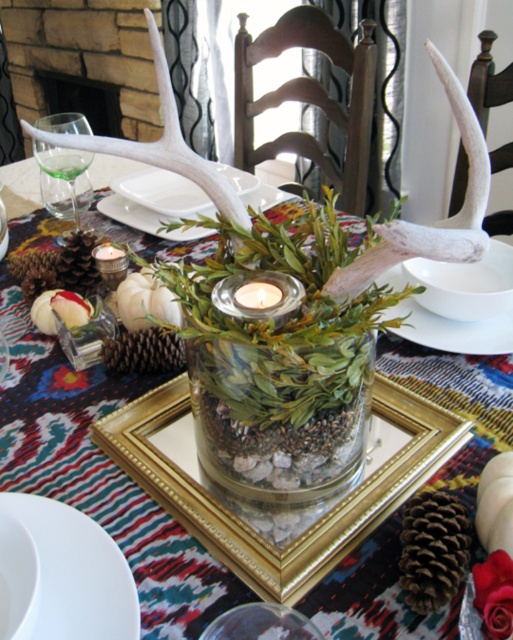
Does white porcelain plate at center appear over translucent glass platter at center?

Yes.

Which is below, white porcelain plate at center or translucent glass platter at center?

translucent glass platter at center is below.

The height and width of the screenshot is (640, 513). Describe the element at coordinates (163, 192) in the screenshot. I see `white porcelain plate at center` at that location.

Identify the location of white porcelain plate at center. This screenshot has height=640, width=513. (163, 192).

Which of these two, brown rough pine cone at center or white porcelain plate at center, stands shorter?

Standing shorter between the two is brown rough pine cone at center.

Is point (425, 586) closer to viewer compared to point (180, 204)?

Yes.

Does point (446, 529) come in front of point (157, 173)?

Yes.

Find the location of a particular element. brown rough pine cone at center is located at coordinates (433, 548).

Between white ceramic plate at lower left and translucent glass platter at center, which one appears on the left side from the viewer's perspective?

white ceramic plate at lower left

Can you confirm if white ceramic plate at lower left is positioned to the right of translucent glass platter at center?

Incorrect, white ceramic plate at lower left is not on the right side of translucent glass platter at center.

Who is more distant from viewer, (9, 612) or (136, 212)?

Point (136, 212)

Find the location of a particular element. The image size is (513, 640). white ceramic plate at lower left is located at coordinates (61, 573).